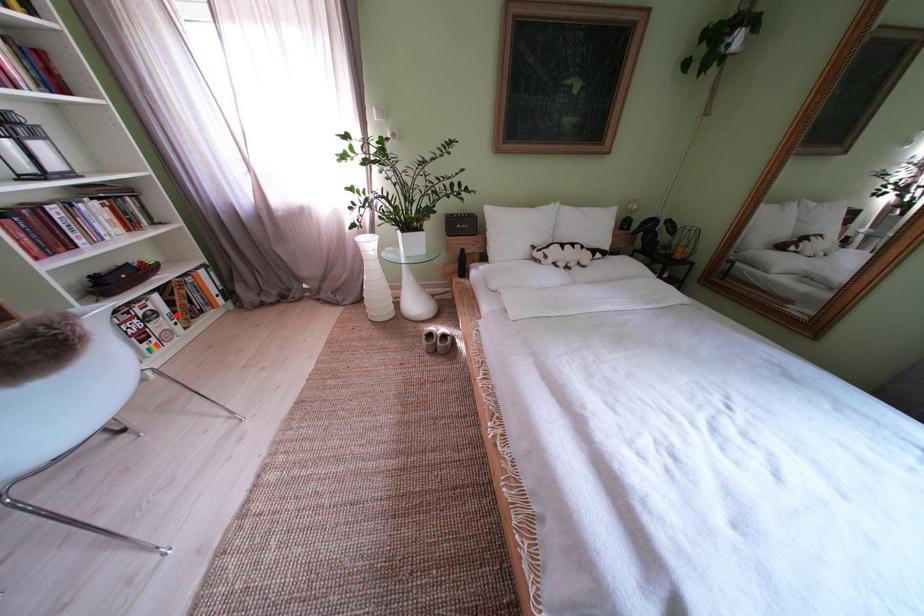
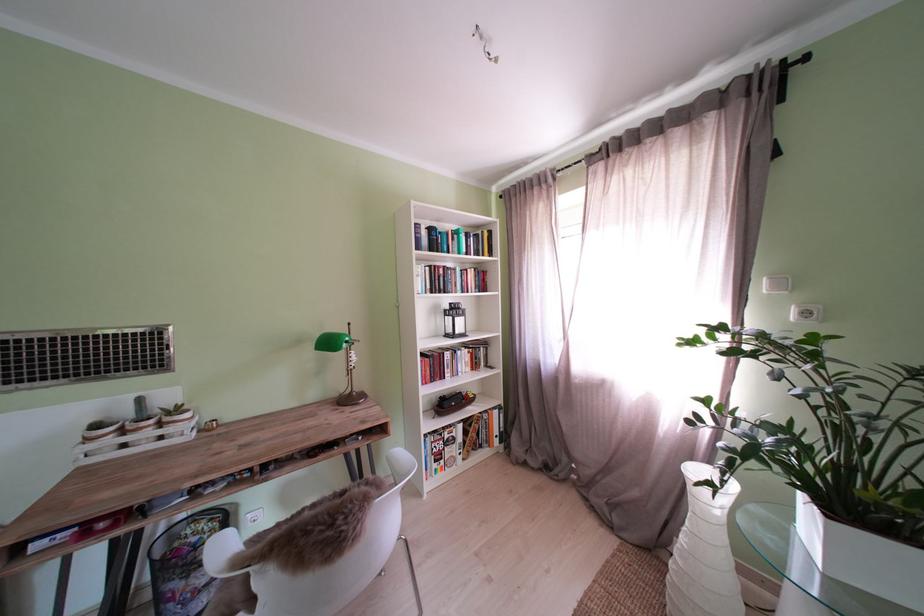
Question: I am providing you with two images of the same scene from different viewpoints. Image1 has a red point marked. In image2, the corresponding 3D location appears at what relative position? Reply with the corresponding letter.

Choices:
 (A) Closer
 (B) Farther

Answer: (B)